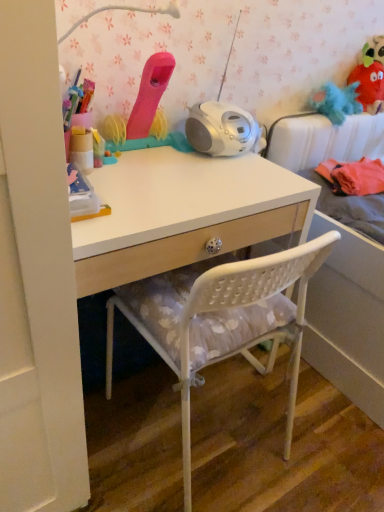
Question: From the image's perspective, is white plastic chair at center located above or below fuzzy fabric plush at upper right, arranged as the 1th toy when viewed from the back?

Choices:
 (A) above
 (B) below

Answer: (B)

Question: From a real-world perspective, is white plastic chair at center positioned above or below fuzzy fabric plush at upper right, marked as the third toy in a front-to-back arrangement?

Choices:
 (A) above
 (B) below

Answer: (B)

Question: Considering the real-world distances, which object is farthest from the matte pink toy at upper center, arranged as the first toy when viewed from the front?

Choices:
 (A) white fabric bed at upper right
 (B) white plastic chair at center
 (C) blue fluffy toy at upper right, the 2th toy viewed from the front
 (D) fuzzy fabric plush at upper right, which ranks as the third toy in left-to-right order
 (E) white matte desk at center

Answer: (D)

Question: Which is farther from the blue fluffy toy at upper right, positioned as the 2th toy in right-to-left order?

Choices:
 (A) fuzzy fabric plush at upper right, marked as the third toy in a front-to-back arrangement
 (B) white matte desk at center
 (C) white fabric bed at upper right
 (D) white plastic chair at center
 (E) matte pink toy at upper center, arranged as the first toy when viewed from the front

Answer: (D)